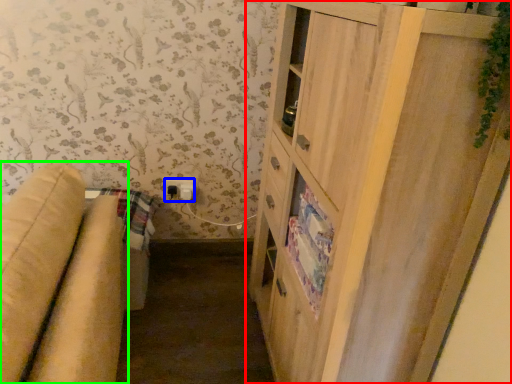
Question: Which is nearer to the cupboard (highlighted by a red box)? electric outlet (highlighted by a blue box) or studio couch (highlighted by a green box).

Choices:
 (A) electric outlet
 (B) studio couch

Answer: (B)